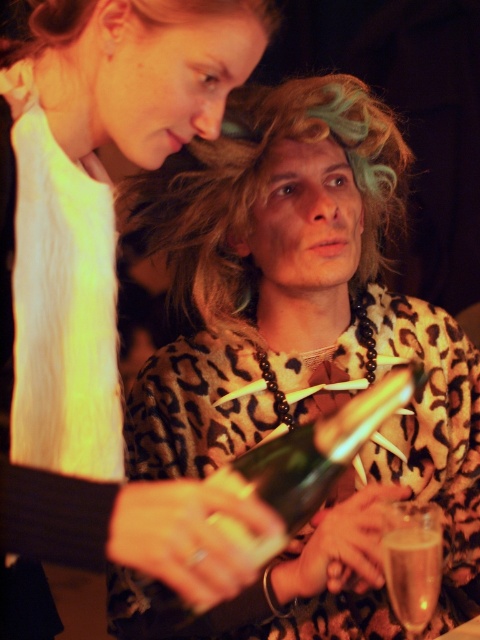
You are at a party and want to give a gift to the person in the leopard print sweater at center. The gift is too big to carry, so you need to place it on the floor near them. Where should you put it relative to the matte white shirt at upper left?

You should place the gift to the right of the matte white shirt at upper left because the leopard print sweater at center is located to the right of it.

You are a bartender at a party and need to place a 12 inch long tray between the leopard print sweater at center and the clear glass at lower right. Will the tray fit between them without touching either object?

The leopard print sweater at center and clear glass at lower right are 13.66 inches apart from each other. Since the tray is 12 inches long, it will fit between them with 1.66 inches of space remaining.

You are a bartender at a party and need to place a new drink order on a shelf. The shelf has a height limit of 28 inches. Can you safely place the drink order at the point marked as point (124, 65) without exceeding the shelf height limit?

The distance of point (124, 65) from viewer is 28.14 inches, which is slightly over the 28 inches height limit. Therefore, placing the drink order there may exceed the shelf height limit.